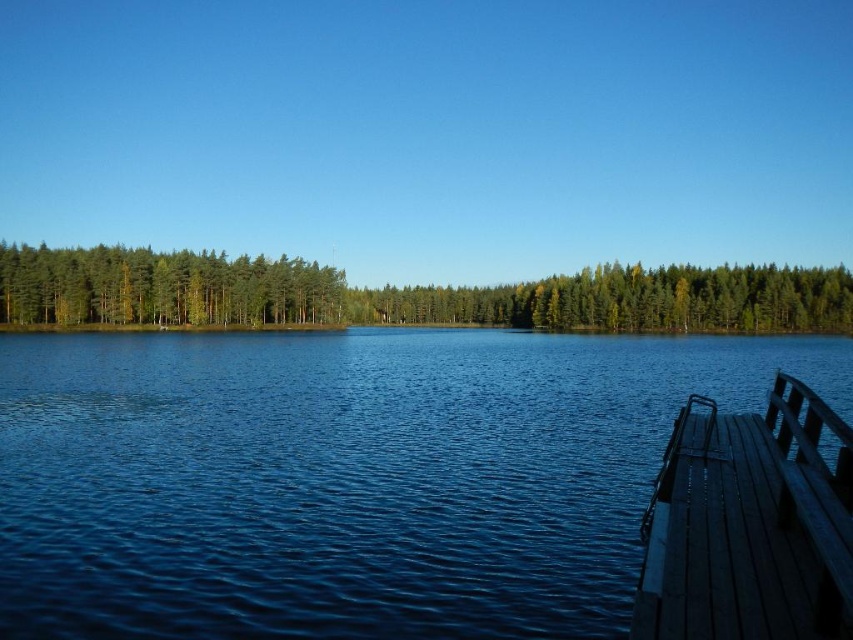
Question: Which object appears closest to the camera in this image?

Choices:
 (A) blue water at center
 (B) green matte trees at upper center

Answer: (A)

Question: Estimate the real-world distances between objects in this image. Which object is closer to the green matte trees at left?

Choices:
 (A) blue water at center
 (B) wooden dock at lower right
 (C) green matte trees at upper center

Answer: (C)

Question: Does blue water at center have a lesser width compared to green matte trees at upper center?

Choices:
 (A) yes
 (B) no

Answer: (A)

Question: Observing the image, what is the correct spatial positioning of blue water at center in reference to green matte trees at upper center?

Choices:
 (A) below
 (B) above

Answer: (A)

Question: Is wooden dock at lower right bigger than green matte trees at left?

Choices:
 (A) yes
 (B) no

Answer: (B)

Question: Which object appears farthest from the camera in this image?

Choices:
 (A) green matte trees at left
 (B) wooden dock at lower right
 (C) blue water at center
 (D) green matte trees at upper center

Answer: (D)